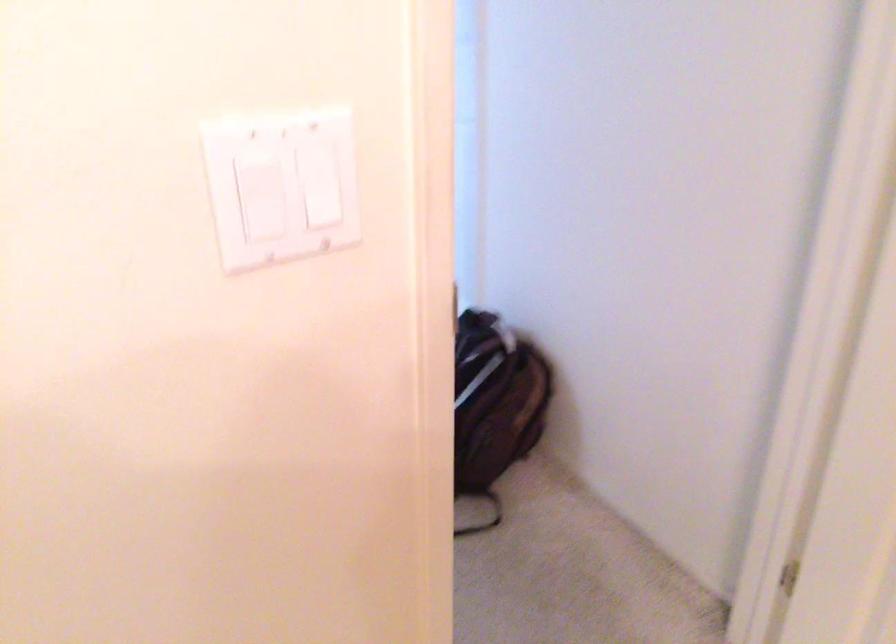
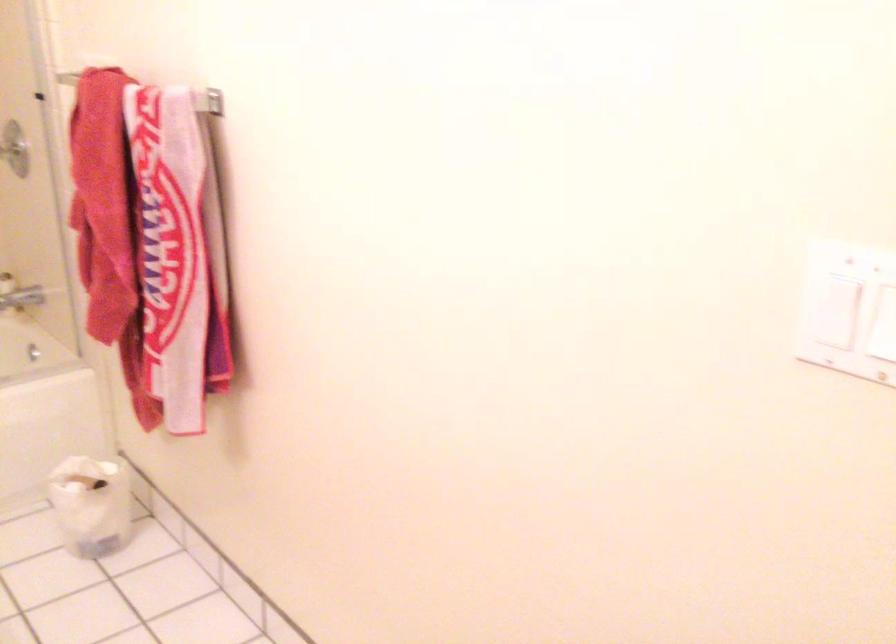
Where in the second image is the point corresponding to [317,218] from the first image?

(883, 319)